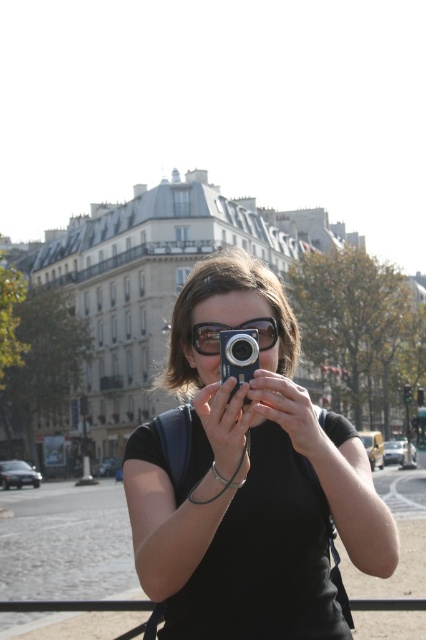
Question: Is matte black camera at center positioned before sunglasses at center?

Choices:
 (A) yes
 (B) no

Answer: (A)

Question: Which of these objects is positioned closest to the sunglasses at center?

Choices:
 (A) matte black camera at center
 (B) metallic silver camera at center

Answer: (B)

Question: Which point is closer to the camera?

Choices:
 (A) tap(287, 604)
 (B) tap(256, 355)

Answer: (A)

Question: Does matte black camera at center appear on the right side of metallic silver camera at center?

Choices:
 (A) no
 (B) yes

Answer: (B)

Question: Is metallic silver camera at center above sunglasses at center?

Choices:
 (A) no
 (B) yes

Answer: (A)

Question: Which of these objects is positioned closest to the metallic silver camera at center?

Choices:
 (A) matte black camera at center
 (B) sunglasses at center

Answer: (A)